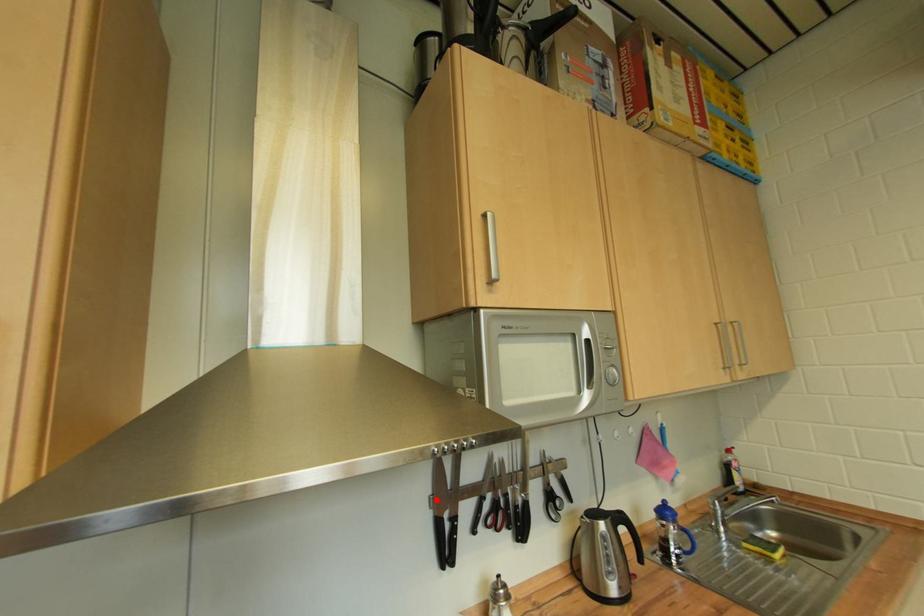
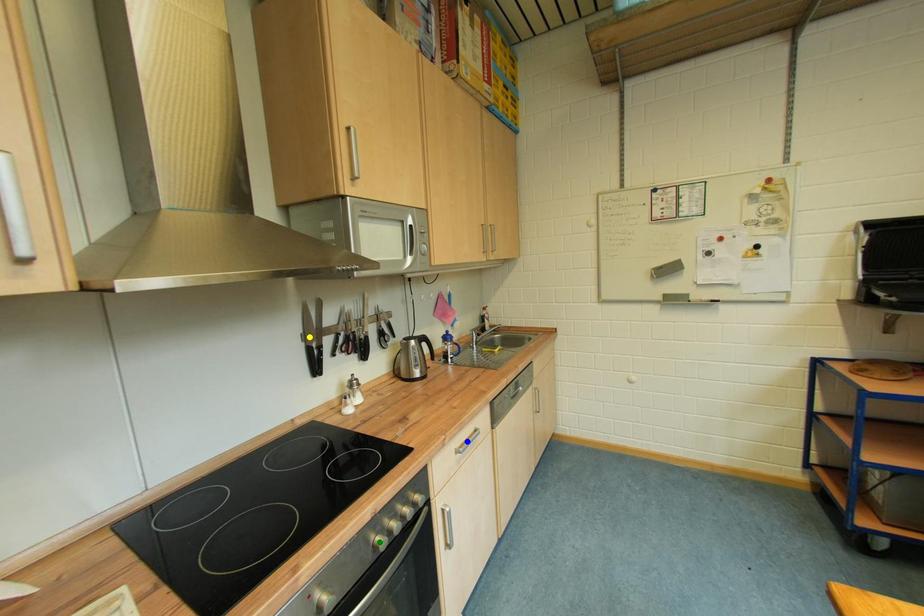
Question: I am providing you with two images of the same scene from different viewpoints. A red point is marked on the first image. You are given multiple points on the second image. Which point in image 2 is actually the same real-world point as the red point in image 1?

Choices:
 (A) green point
 (B) blue point
 (C) yellow point

Answer: (C)